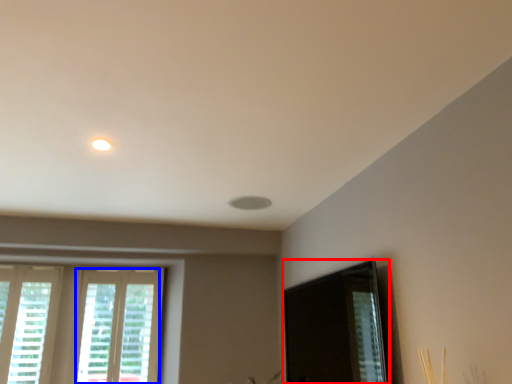
Question: Which of the following is the farthest to the observer, screen door (highlighted by a red box) or window (highlighted by a blue box)?

Choices:
 (A) screen door
 (B) window

Answer: (B)